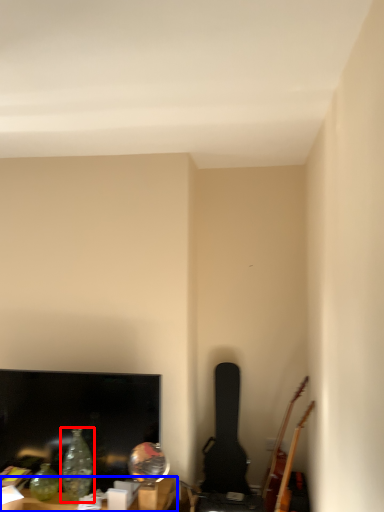
Question: Among these objects, which one is nearest to the camera, glass vase (highlighted by a red box) or furniture (highlighted by a blue box)?

Choices:
 (A) glass vase
 (B) furniture

Answer: (B)